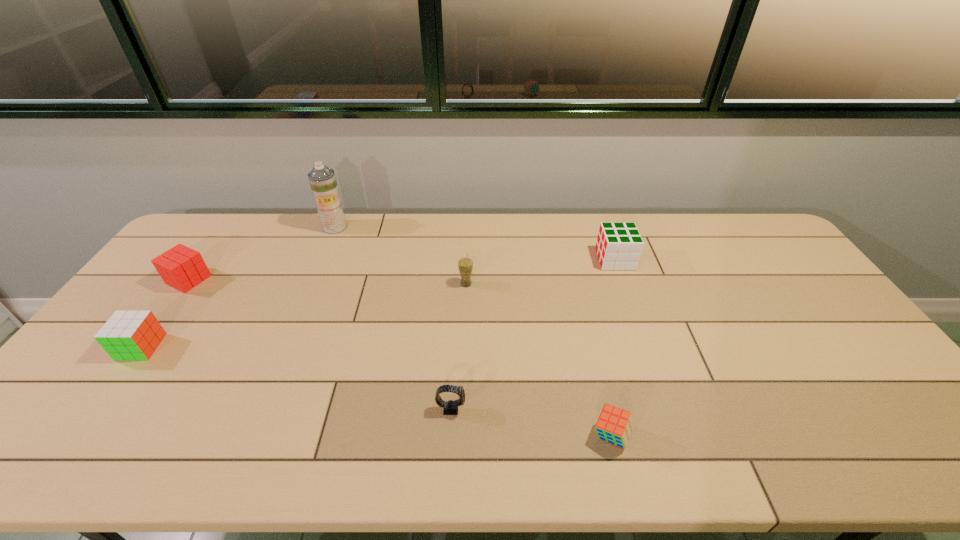
Image resolution: width=960 pixels, height=540 pixels. Find the location of `vacant space located on the left of the sixth shortest object`. vacant space located on the left of the sixth shortest object is located at coordinates (345, 284).

In order to click on free space located 0.220m on the red face of the tallest cube in this screenshot , I will do `click(533, 260)`.

I want to click on vacant space located on the red face of the tallest cube, so click(565, 260).

The width and height of the screenshot is (960, 540). I want to click on free region located 0.220m on the red face of the tallest cube, so click(533, 260).

The height and width of the screenshot is (540, 960). What are the coordinates of `vacant point located 0.230m on the front of the fifth farthest object` in the screenshot? It's located at (71, 442).

Find the location of `free spot located on the face of the watch`. free spot located on the face of the watch is located at coordinates (602, 408).

At what (x,y) coordinates should I click in order to perform the action: click on vacant region located on the right of the nearest object. Please return your answer as a coordinate pair (x, y). This screenshot has height=540, width=960. Looking at the image, I should click on (715, 435).

Where is `aerosol can located in the far edge section of the desktop`? aerosol can located in the far edge section of the desktop is located at coordinates (322, 179).

Where is `cube positioned at the far edge`? The height and width of the screenshot is (540, 960). cube positioned at the far edge is located at coordinates (619, 245).

Identify the location of object situated at the near edge. This screenshot has height=540, width=960. (614, 425).